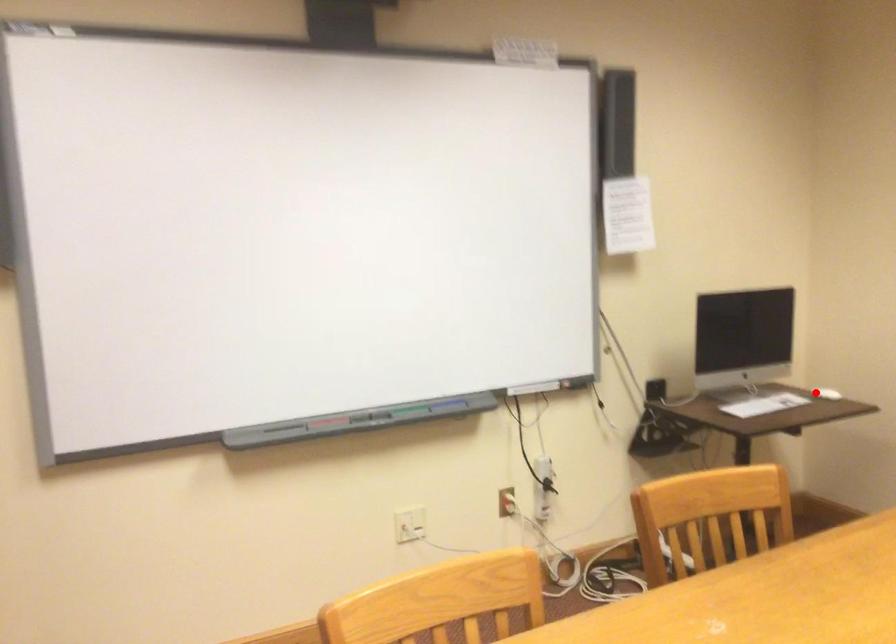
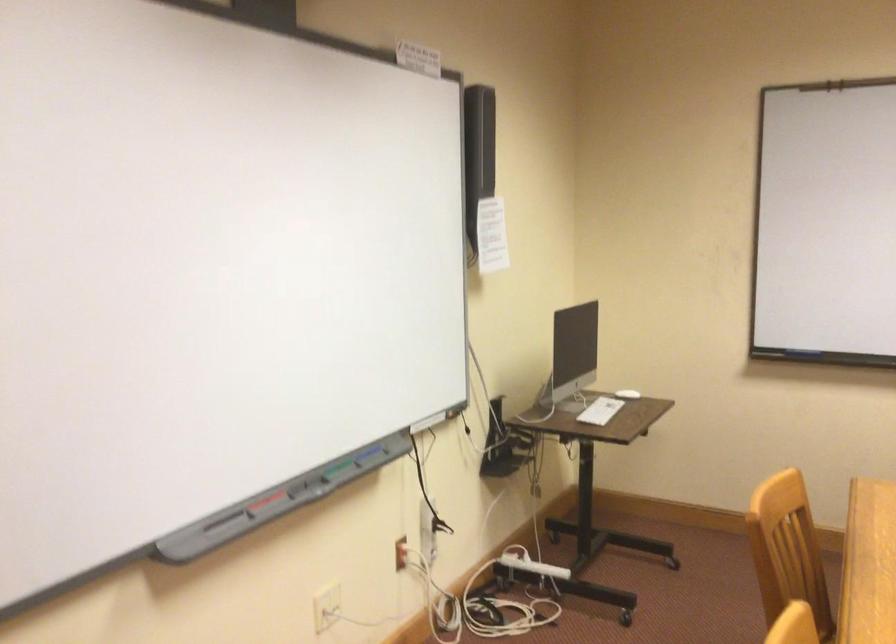
Find the pixel in the second image that matches the highlighted location in the first image.

(627, 393)